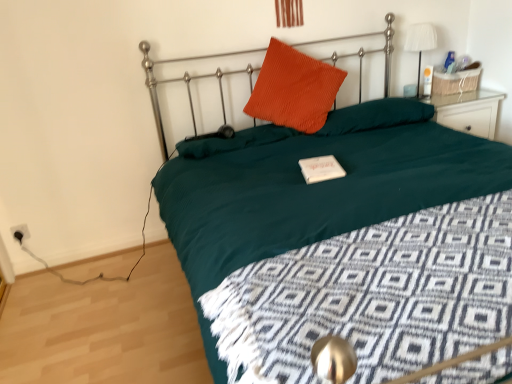
Question: Can you confirm if corduroy orange pillow at center, positioned as the 2th pillow in left-to-right order, is shorter than black plastic socket at lower left?

Choices:
 (A) yes
 (B) no

Answer: (B)

Question: Considering the relative positions of corduroy orange pillow at center, the second pillow from the right, and black plastic socket at lower left in the image provided, is corduroy orange pillow at center, the second pillow from the right, to the left of black plastic socket at lower left from the viewer's perspective?

Choices:
 (A) yes
 (B) no

Answer: (B)

Question: Is corduroy orange pillow at center, the second pillow from the right, taller than black plastic socket at lower left?

Choices:
 (A) yes
 (B) no

Answer: (A)

Question: From a real-world perspective, is corduroy orange pillow at center, positioned as the 2th pillow in left-to-right order, positioned under black plastic socket at lower left based on gravity?

Choices:
 (A) no
 (B) yes

Answer: (A)

Question: Is corduroy orange pillow at center, positioned as the 2th pillow in left-to-right order, wider than black plastic socket at lower left?

Choices:
 (A) no
 (B) yes

Answer: (B)

Question: From a real-world perspective, relative to white fabric lampshade at upper right, is teal fabric bed at center vertically above or below?

Choices:
 (A) above
 (B) below

Answer: (B)

Question: Is point (298, 157) positioned closer to the camera than point (407, 33)?

Choices:
 (A) closer
 (B) farther

Answer: (A)

Question: Choose the correct answer: Is teal fabric bed at center inside white fabric lampshade at upper right or outside it?

Choices:
 (A) outside
 (B) inside

Answer: (A)

Question: Considering the positions of teal fabric bed at center and white fabric lampshade at upper right in the image, is teal fabric bed at center bigger or smaller than white fabric lampshade at upper right?

Choices:
 (A) small
 (B) big

Answer: (B)

Question: From the image's perspective, is white fabric lampshade at upper right positioned above or below orange corduroy pillow at center, the first pillow when ordered from left to right?

Choices:
 (A) above
 (B) below

Answer: (A)

Question: In terms of width, does white fabric lampshade at upper right look wider or thinner when compared to orange corduroy pillow at center, the first pillow when ordered from left to right?

Choices:
 (A) wide
 (B) thin

Answer: (B)

Question: In the image, is white fabric lampshade at upper right positioned in front of or behind orange corduroy pillow at center, the 3th pillow viewed from the right?

Choices:
 (A) front
 (B) behind

Answer: (B)

Question: Is white fabric lampshade at upper right inside or outside of orange corduroy pillow at center, the first pillow when ordered from left to right?

Choices:
 (A) inside
 (B) outside

Answer: (B)

Question: From a real-world perspective, is orange corduroy pillow at upper center, the 3th pillow in the left-to-right sequence, positioned above or below black plastic socket at lower left?

Choices:
 (A) below
 (B) above

Answer: (B)

Question: Is orange corduroy pillow at upper center, the 1th pillow positioned from the right, bigger or smaller than black plastic socket at lower left?

Choices:
 (A) small
 (B) big

Answer: (B)